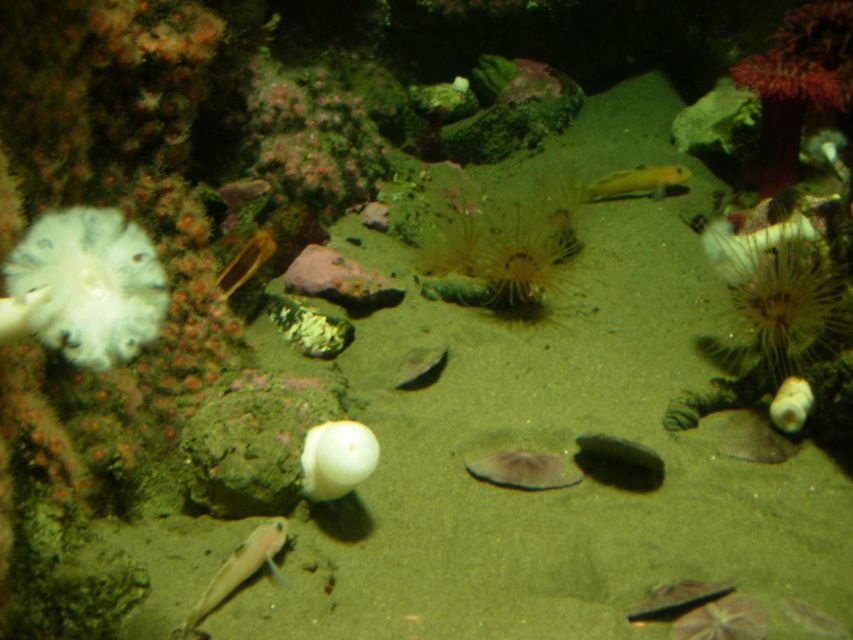
Question: Does shiny silver fish at lower center appear over yellow-green glossy fish at upper right?

Choices:
 (A) no
 (B) yes

Answer: (A)

Question: Which point is farther to the camera?

Choices:
 (A) (241, 556)
 (B) (671, 582)
 (C) (352, 476)
 (D) (730, 237)

Answer: (D)

Question: Does translucent white sea anemone at upper right have a smaller size compared to shiny silver fish at lower center?

Choices:
 (A) no
 (B) yes

Answer: (A)

Question: Which object appears closest to the camera in this image?

Choices:
 (A) translucent white sea anemone at upper right
 (B) white soft coral at left
 (C) shiny silver fish at lower center
 (D) yellow-green glossy fish at upper right

Answer: (B)

Question: Which of the following is the farthest from the observer?

Choices:
 (A) (369, 444)
 (B) (619, 193)
 (C) (212, 588)

Answer: (B)

Question: Is translucent white sea anemone at upper right to the left of yellow-green glossy fish at upper right from the viewer's perspective?

Choices:
 (A) no
 (B) yes

Answer: (A)